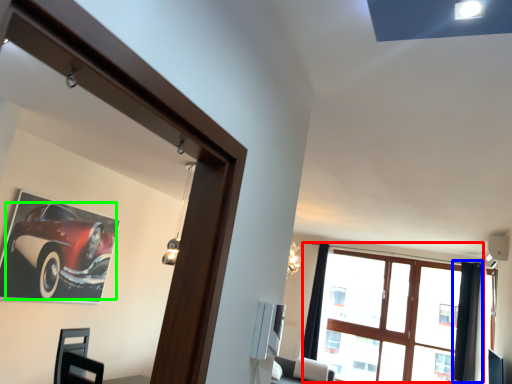
Question: Based on their relative distances, which object is farther from window (highlighted by a red box)? Choose from curtain (highlighted by a blue box) and car (highlighted by a green box).

Choices:
 (A) curtain
 (B) car

Answer: (B)